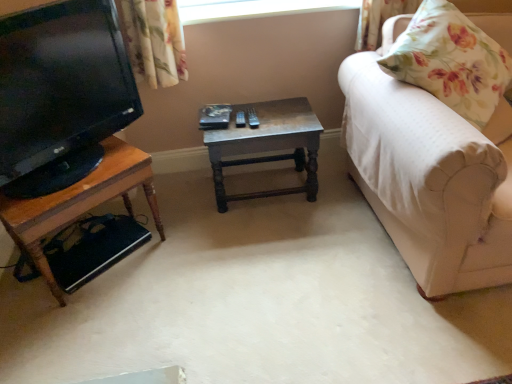
Identify the location of vacant space to the right of wooden table at center, positioned as the second table in left-to-right order. (339, 196).